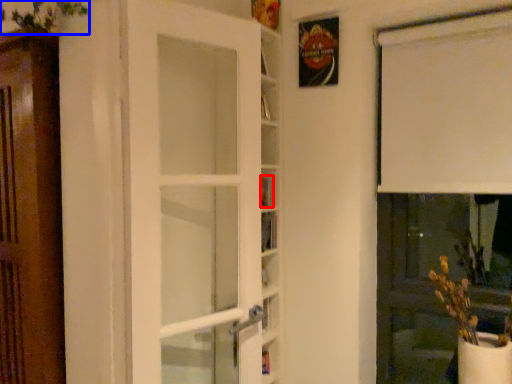
Question: Which object is closer to the camera taking this photo, book (highlighted by a red box) or plant (highlighted by a blue box)?

Choices:
 (A) book
 (B) plant

Answer: (B)